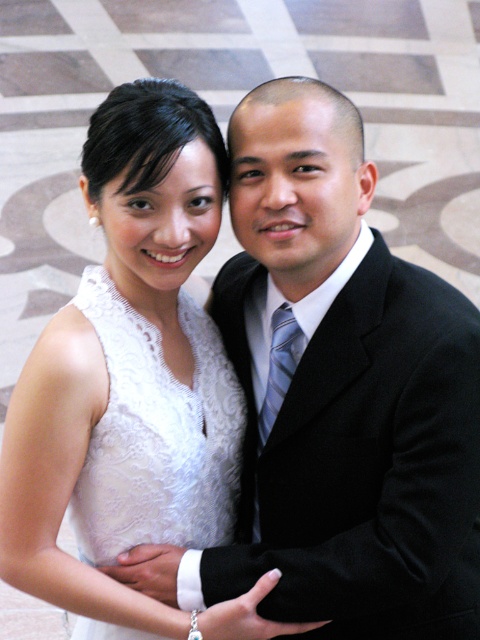
You are a photographer at a wedding. You need to place a bouquet in the image so that it is exactly at the point with coordinates point [360,458]. What object will the bouquet be placed on or near?

The point [360,458] corresponds to the black satin business suit at right, so the bouquet will be placed on or near the black satin business suit at right.

You are a photographer setting up for a formal event. You need to position two individuals so that they are both visible in the frame. The black satin business suit at right and the white lace dress at center are the focal points. Based on their sizes, which one might require more space on the sides of the frame?

The black satin business suit at right might require more space on the sides of the frame since it might be wider than the white lace dress at center.